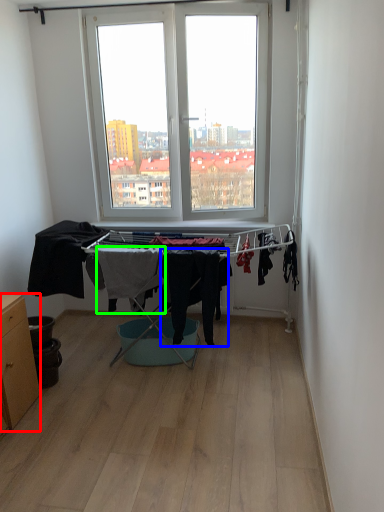
Question: Estimate the real-world distances between objects in this image. Which object is closer to table (highlighted by a red box), clothing (highlighted by a blue box) or clothing (highlighted by a green box)?

Choices:
 (A) clothing
 (B) clothing

Answer: (B)